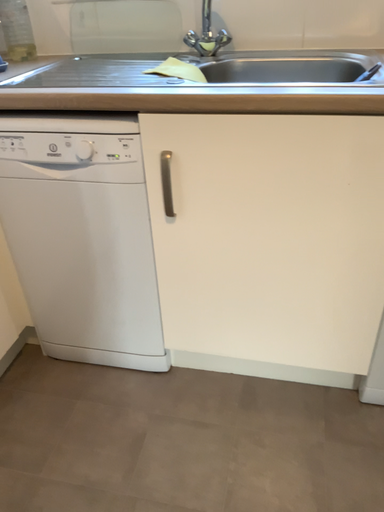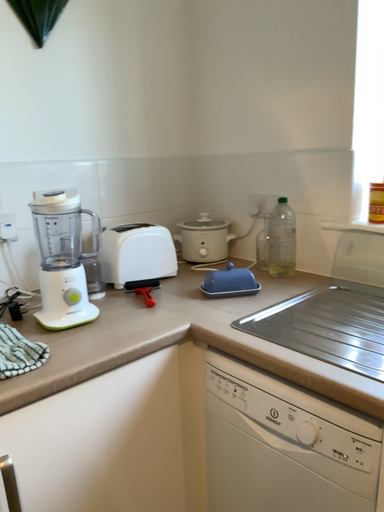
Question: How did the camera likely rotate when shooting the video?

Choices:
 (A) rotated downward
 (B) rotated upward

Answer: (B)